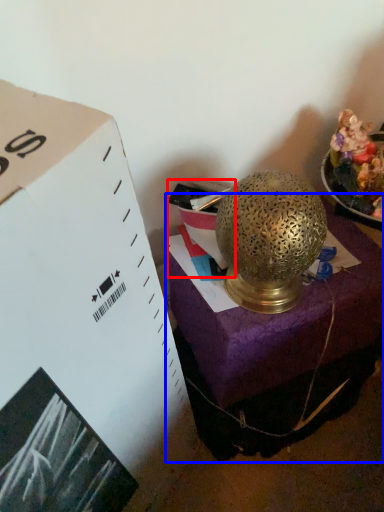
Question: Which object appears farthest to the camera in this image, box (highlighted by a red box) or furniture (highlighted by a blue box)?

Choices:
 (A) box
 (B) furniture

Answer: (A)